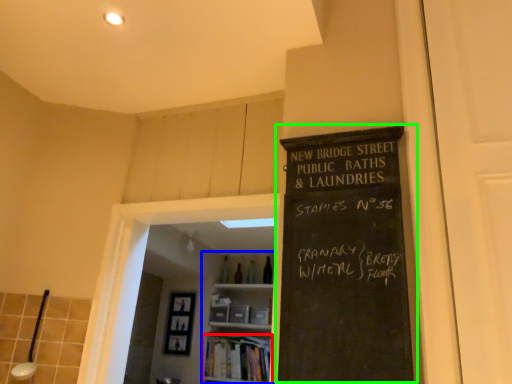
Question: Based on their relative distances, which object is nearer to book (highlighted by a red box)? Choose from bookshelf (highlighted by a blue box) and bulletin board (highlighted by a green box).

Choices:
 (A) bookshelf
 (B) bulletin board

Answer: (A)